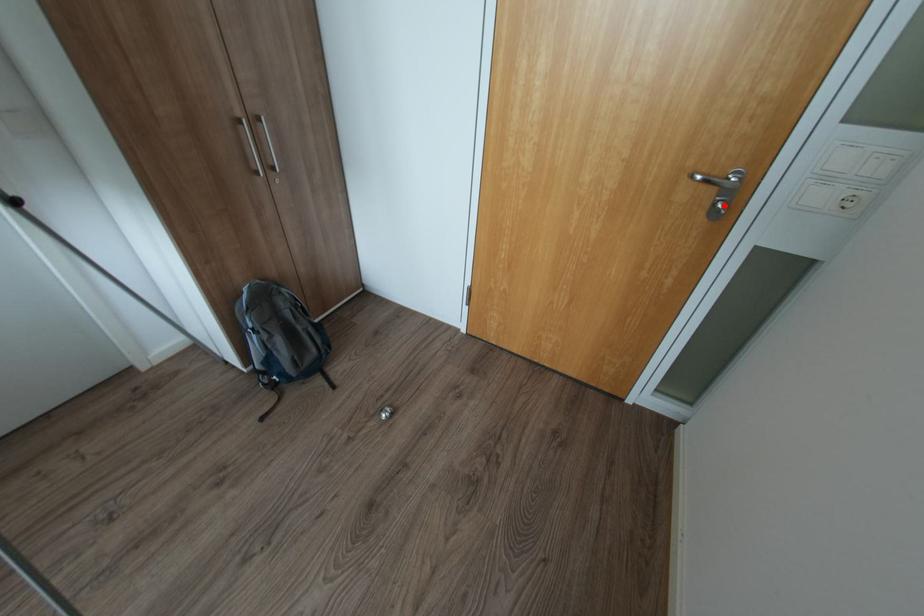
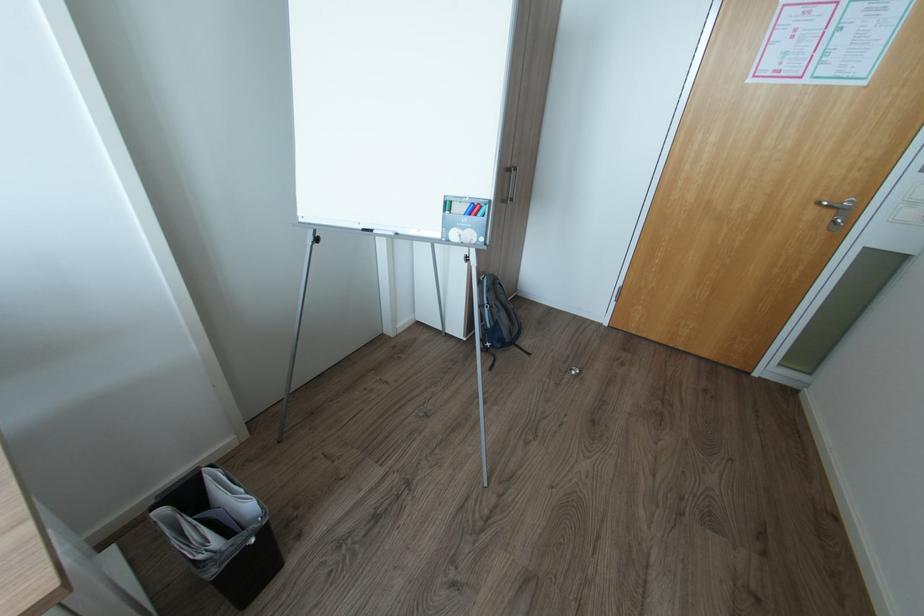
Find the pixel in the second image that matches the highlighted location in the first image.

(845, 221)